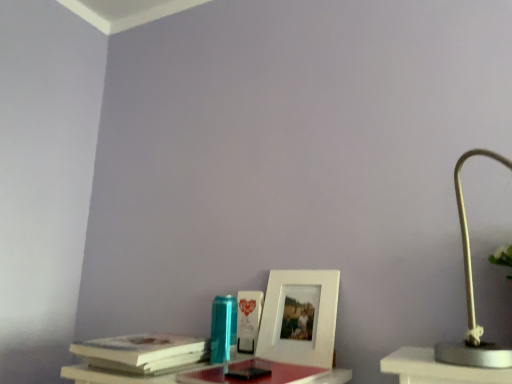
Question: Can you confirm if white matte picture frame at center is positioned to the left of white paper at left?

Choices:
 (A) no
 (B) yes

Answer: (A)

Question: Is white matte picture frame at center in front of white paper at left?

Choices:
 (A) no
 (B) yes

Answer: (A)

Question: Considering the relative sizes of white matte picture frame at center and white paper at left in the image provided, is white matte picture frame at center shorter than white paper at left?

Choices:
 (A) yes
 (B) no

Answer: (B)

Question: From the image's perspective, is white matte picture frame at center beneath white paper at left?

Choices:
 (A) no
 (B) yes

Answer: (A)

Question: Is there a large distance between white matte picture frame at center and white paper at left?

Choices:
 (A) yes
 (B) no

Answer: (B)

Question: Considering the relative positions of white matte picture frame at center and white paper at left in the image provided, is white matte picture frame at center to the right of white paper at left from the viewer's perspective?

Choices:
 (A) no
 (B) yes

Answer: (B)

Question: Is the depth of white paper at left greater than that of smooth plastic table at lower center?

Choices:
 (A) no
 (B) yes

Answer: (B)

Question: From a real-world perspective, is white paper at left located higher than smooth plastic table at lower center?

Choices:
 (A) no
 (B) yes

Answer: (B)

Question: Does white paper at left contain smooth plastic table at lower center?

Choices:
 (A) yes
 (B) no

Answer: (B)

Question: Can you confirm if white paper at left is taller than smooth plastic table at lower center?

Choices:
 (A) no
 (B) yes

Answer: (B)

Question: Is white paper at left closer to camera compared to smooth plastic table at lower center?

Choices:
 (A) no
 (B) yes

Answer: (A)

Question: Is white paper at left at the right side of smooth plastic table at lower center?

Choices:
 (A) no
 (B) yes

Answer: (A)

Question: From the image's perspective, is white paper at left on top of white matte lamp at right?

Choices:
 (A) yes
 (B) no

Answer: (B)